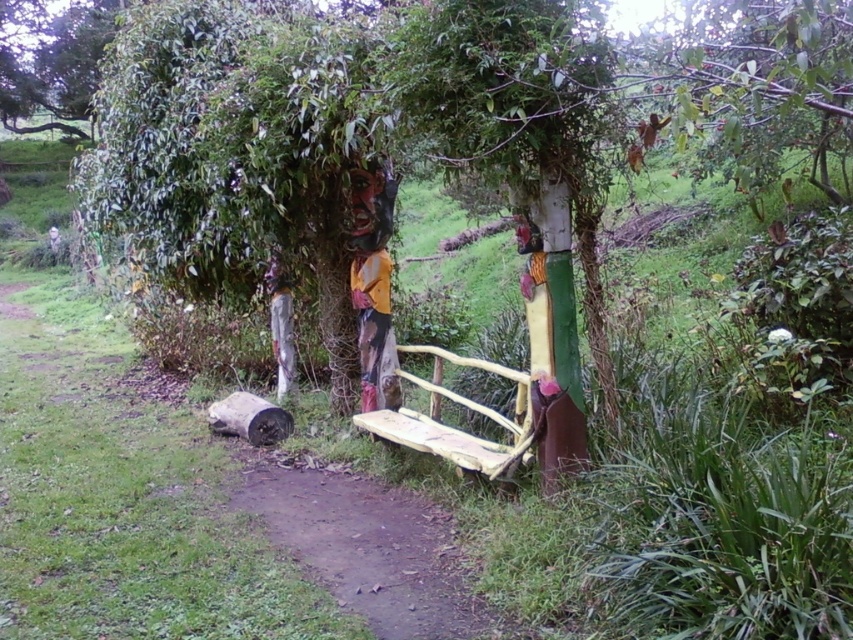
You are standing at the entrance of the garden and want to sit on the yellow painted wood bench at center. Which direction should you walk to reach it from the dirt path at center?

The dirt path at center is in front of the yellow painted wood bench at center, so you should walk backward to reach the bench from the dirt path at center.

You are planning to walk along the dirt path at center in the garden. There is a yellow painted wood bench at center nearby. Which one takes up more space in the image?

The yellow painted wood bench at center occupies more space than the dirt path at center, so the bench takes up more space.